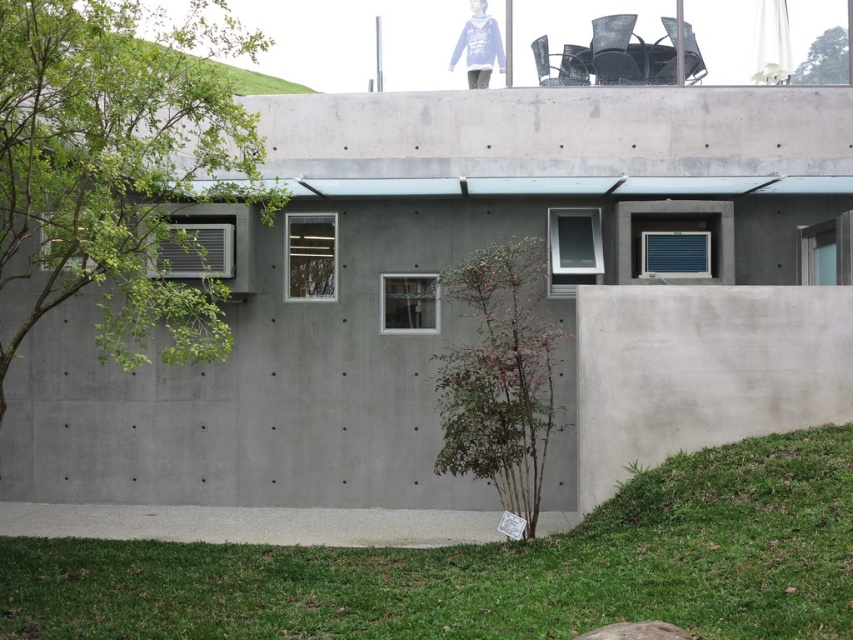
You are a painter standing in front of the building. You want to paint the gray concrete wall at center and the green leafy tree at left. Which object should you focus on first if you want to paint the smaller one first?

The gray concrete wall at center has a smaller size compared to the green leafy tree at left, so you should focus on painting the gray concrete wall at center first.

You are standing in front of the modern building and want to take a photo of the green leafy tree at upper right. To avoid the smooth concrete wall at lower right from appearing in the background, should you move closer to or further away from the tree?

To avoid the smooth concrete wall at lower right appearing in the background, you should move closer to the green leafy tree at upper right. Since the wall is located below the tree, moving closer will narrow the field of view and reduce the chance of the wall being in the background.

You are a painter who needs to decide which surface to paint first. Given that the smooth concrete wall at lower right and the green leafy tree at upper right are both in your view, which one would require more paint due to its size?

The smooth concrete wall at lower right has a larger size compared to the green leafy tree at upper right, so it would require more paint.